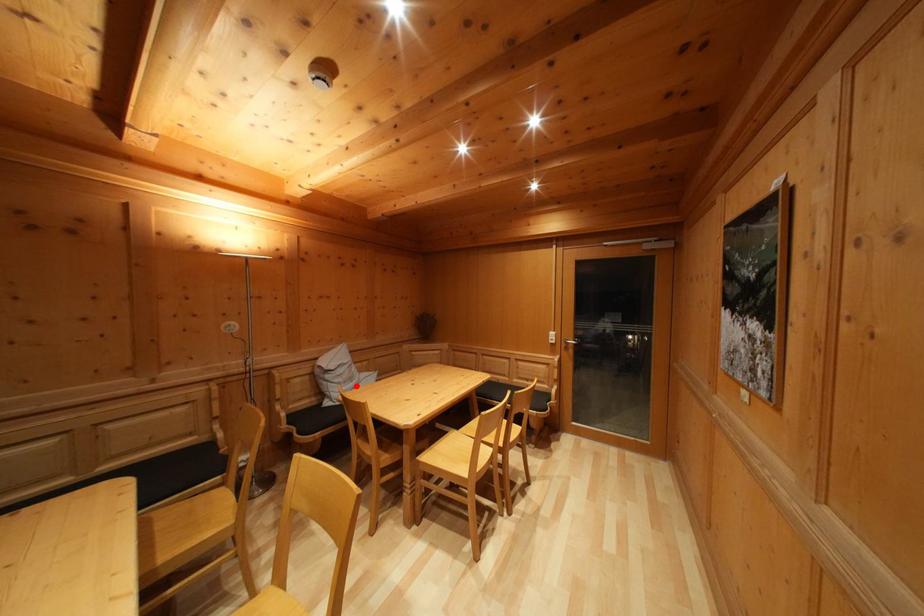
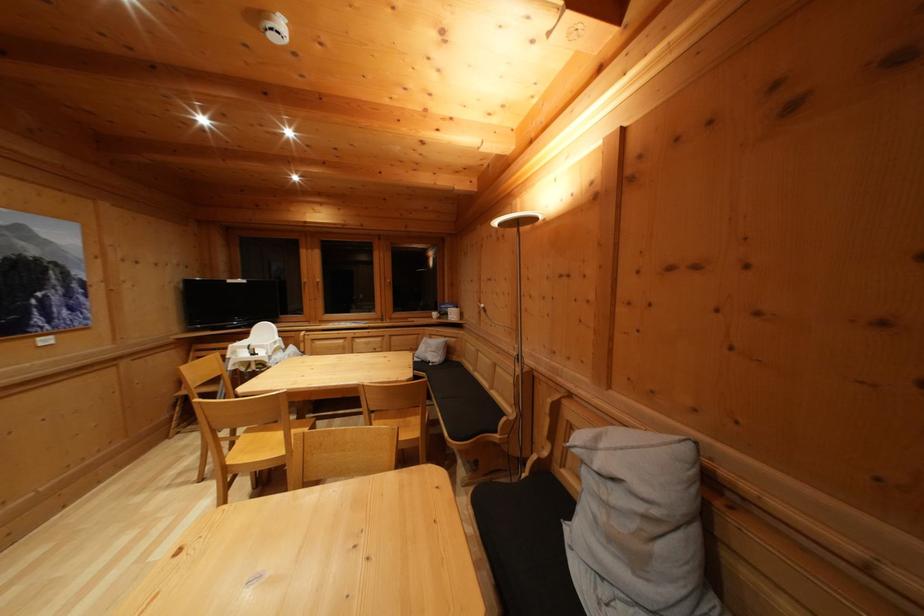
Question: I am providing you with two images of the same scene from different viewpoints. A red point is marked on the first image. At the location where the point appears in image 1, is it still visible in image 2?

Choices:
 (A) Yes
 (B) No

Answer: (A)